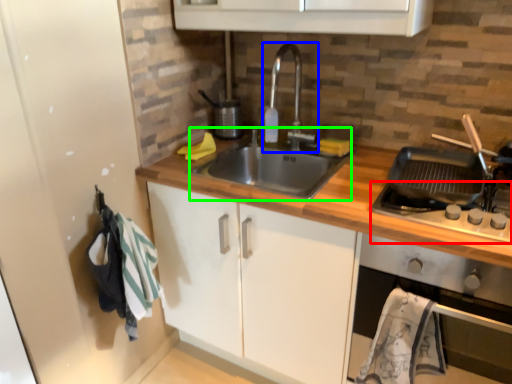
Question: Which object is positioned farthest from gas stove (highlighted by a red box)? Select from tap (highlighted by a blue box) and sink (highlighted by a green box).

Choices:
 (A) tap
 (B) sink

Answer: (A)